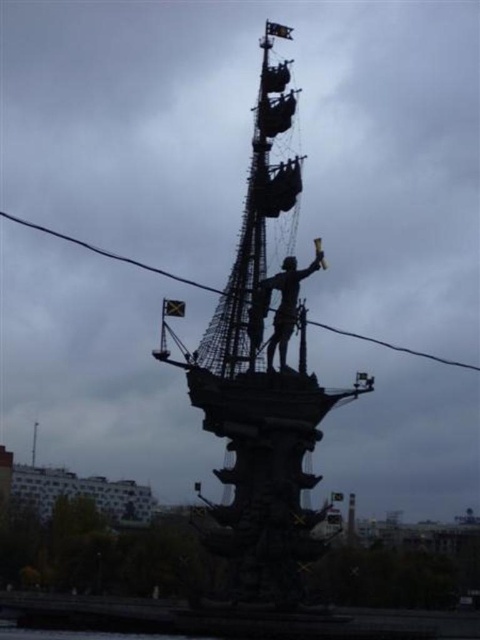
Question: Which of the following is the farthest from the observer?

Choices:
 (A) (305, 541)
 (B) (275, 332)

Answer: (B)

Question: Does black matte ship at center lie behind silhouette bronze statue at center?

Choices:
 (A) yes
 (B) no

Answer: (B)

Question: Does black matte ship at center come behind black wire at center?

Choices:
 (A) no
 (B) yes

Answer: (A)

Question: Is silhouette bronze statue at center smaller than black wire at center?

Choices:
 (A) no
 (B) yes

Answer: (B)

Question: Which of the following is the farthest from the observer?

Choices:
 (A) (263, 285)
 (B) (399, 348)
 (C) (181, 348)

Answer: (B)

Question: Which object is the closest to the black matte ship at center?

Choices:
 (A) black wire at center
 (B) silhouette bronze statue at center

Answer: (B)